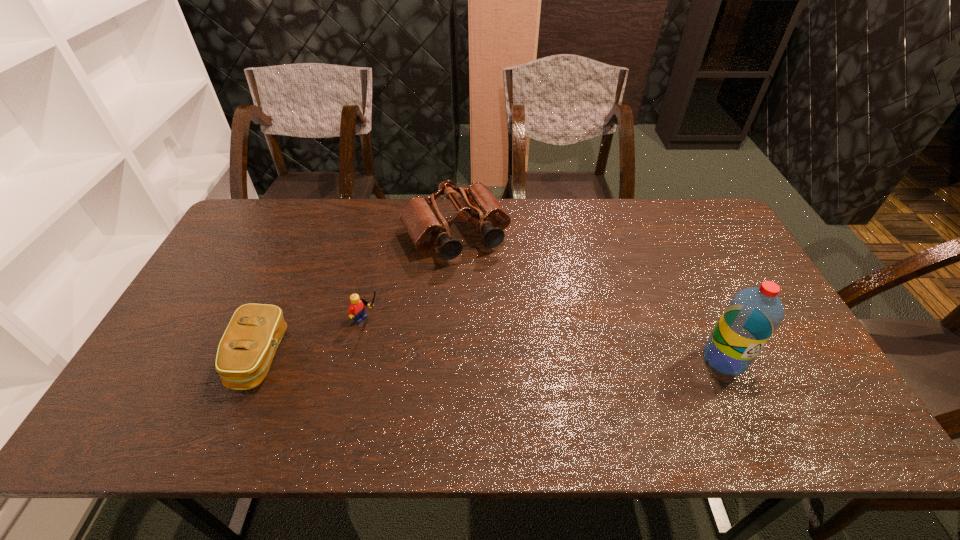
What are the coordinates of `object at the right edge` in the screenshot? It's located at (752, 316).

Locate an element on the screen. Image resolution: width=960 pixels, height=540 pixels. object that is positioned at the near right corner is located at coordinates (752, 316).

Where is `vacant area at the far edge`? The width and height of the screenshot is (960, 540). vacant area at the far edge is located at coordinates [x=461, y=224].

The width and height of the screenshot is (960, 540). Identify the location of vacant space at the near edge. (208, 384).

The width and height of the screenshot is (960, 540). Identify the location of blank space at the right edge of the desktop. (715, 279).

Find the location of `vacant region at the far left corner of the desktop`. vacant region at the far left corner of the desktop is located at coordinates (255, 230).

Locate an element on the screen. The image size is (960, 540). free spot between the shortest object and the tallest object is located at coordinates coord(492,358).

Identify the location of unoccupied position between the second object from left to right and the binoculars. Image resolution: width=960 pixels, height=540 pixels. (412, 278).

Locate an element on the screen. This screenshot has width=960, height=540. empty space between the third object from right to left and the shortest object is located at coordinates (314, 339).

The width and height of the screenshot is (960, 540). In order to click on vacant area between the rightmost object and the Lego in this screenshot , I will do `click(546, 339)`.